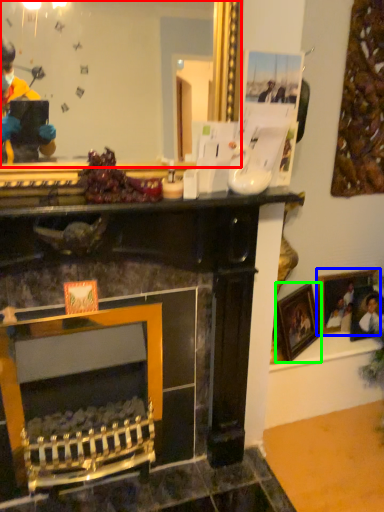
Question: Based on their relative distances, which object is nearer to mirror (highlighted by a red box)? Choose from picture frame (highlighted by a blue box) and picture frame (highlighted by a green box).

Choices:
 (A) picture frame
 (B) picture frame

Answer: (B)